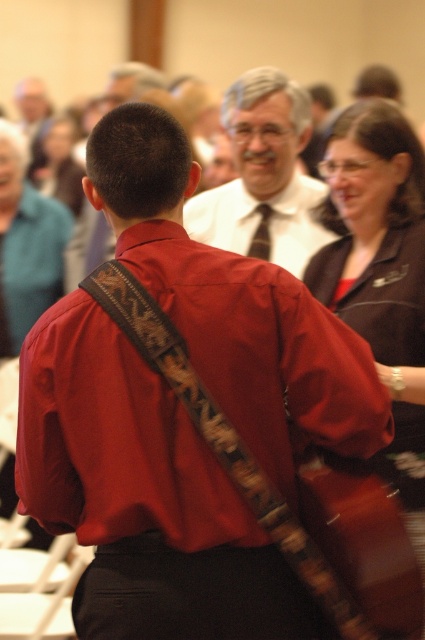
Who is higher up, matte white shirt at center or dark gray textured tie at center?

Positioned higher is matte white shirt at center.

Does matte white shirt at center appear on the left side of dark gray textured tie at center?

Incorrect, matte white shirt at center is not on the left side of dark gray textured tie at center.

Image resolution: width=425 pixels, height=640 pixels. In order to click on matte white shirt at center in this screenshot , I will do `click(263, 173)`.

Find the location of a particular element. This screenshot has width=425, height=640. matte white shirt at center is located at coordinates (263, 173).

Is matte black shirt at upper right thinner than dark gray textured tie at center?

No, matte black shirt at upper right is not thinner than dark gray textured tie at center.

Can you confirm if matte black shirt at upper right is smaller than dark gray textured tie at center?

Actually, matte black shirt at upper right might be larger than dark gray textured tie at center.

Locate an element on the screen. Image resolution: width=425 pixels, height=640 pixels. matte black shirt at upper right is located at coordinates (380, 273).

Is matte white shirt at center smaller than teal fabric jacket at upper left?

No.

This screenshot has height=640, width=425. What do you see at coordinates (263, 173) in the screenshot?
I see `matte white shirt at center` at bounding box center [263, 173].

Locate an element on the screen. The height and width of the screenshot is (640, 425). matte white shirt at center is located at coordinates (263, 173).